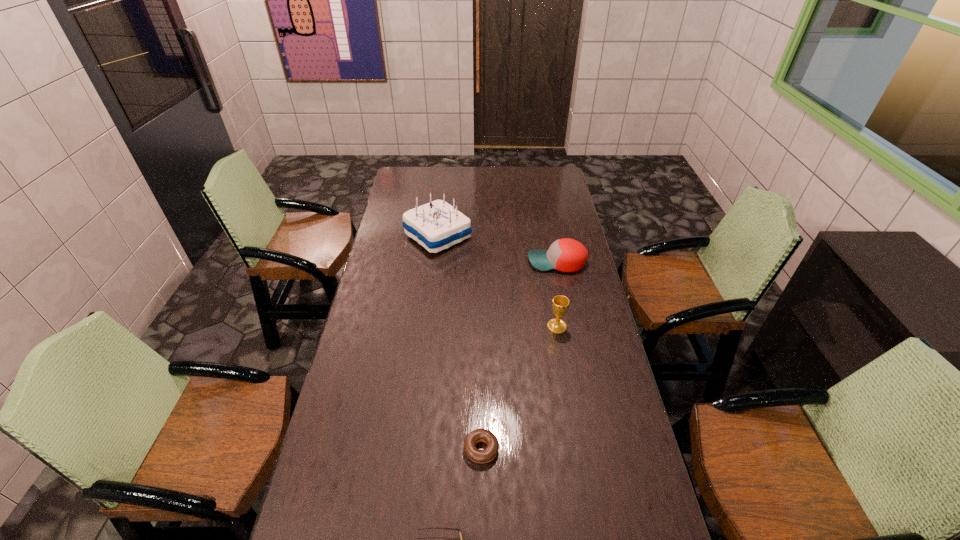
This screenshot has height=540, width=960. I want to click on free space located 0.240m at the brim of the baseball cap, so click(470, 262).

You are a GUI agent. You are given a task and a screenshot of the screen. Output one action in this format:
    pyautogui.click(x=<x>, y=<y>)
    Task: Click on the vacant space located 0.280m on the back of the doughnut
    Image resolution: width=960 pixels, height=540 pixels.
    Given the screenshot: What is the action you would take?
    tap(481, 355)

You are a GUI agent. You are given a task and a screenshot of the screen. Output one action in this format:
    pyautogui.click(x=<x>, y=<y>)
    Task: Click on the object situated at the left edge
    
    Given the screenshot: What is the action you would take?
    pyautogui.click(x=437, y=225)

Locate an element on the screen. This screenshot has height=540, width=960. chalice that is at the right edge is located at coordinates (560, 303).

Find the location of a particular element. This screenshot has height=540, width=960. baseball cap present at the right edge is located at coordinates (566, 255).

In the image, there is a desktop. Where is `free space at the far edge`? free space at the far edge is located at coordinates (497, 177).

Image resolution: width=960 pixels, height=540 pixels. I want to click on vacant region at the left edge, so click(x=372, y=286).

You are a GUI agent. You are given a task and a screenshot of the screen. Output one action in this format:
    pyautogui.click(x=<x>, y=<y>)
    Task: Click on the vacant space at the right edge of the desktop
    The image size is (960, 540).
    Given the screenshot: What is the action you would take?
    pyautogui.click(x=597, y=452)

At what (x,y) coordinates should I click in order to perform the action: click on vacant space that's between the fourth tallest object and the birthday cake. Please return your answer as a coordinate pair (x, y). Looking at the image, I should click on (460, 343).

Where is `free space between the third farthest object and the tallest object`? free space between the third farthest object and the tallest object is located at coordinates (497, 281).